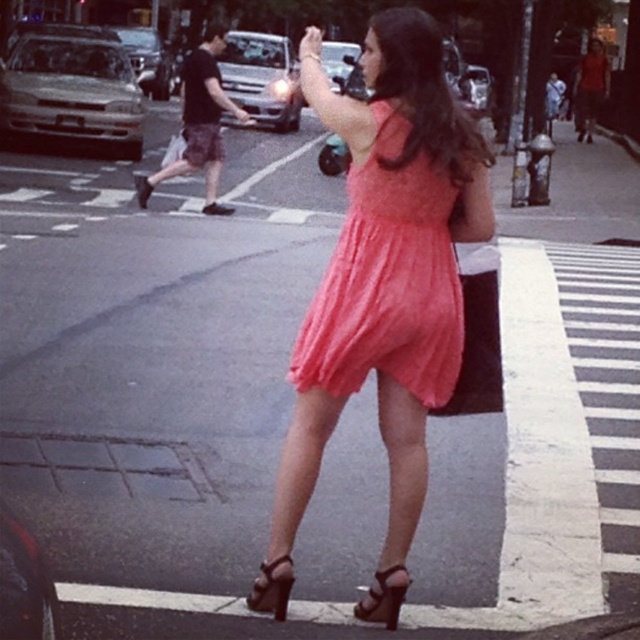
Question: Which object appears closest to the camera in this image?

Choices:
 (A) brown leather sandal at lower center
 (B) coral fabric dress at center
 (C) shiny brown sandal at lower center
 (D) coral chiffon dress at center

Answer: (B)

Question: Is shiny brown sandal at lower center thinner than brown leather sandal at lower center?

Choices:
 (A) yes
 (B) no

Answer: (B)

Question: Estimate the real-world distances between objects in this image. Which object is farther from the coral fabric dress at center?

Choices:
 (A) shiny brown sandal at lower center
 (B) brown leather sandal at lower center
 (C) coral chiffon dress at center

Answer: (B)

Question: Does coral chiffon dress at center appear on the right side of brown leather sandal at lower center?

Choices:
 (A) yes
 (B) no

Answer: (A)

Question: Which point appears closest to the camera in this image?

Choices:
 (A) [337, 106]
 (B) [408, 579]
 (C) [272, 564]
 (D) [396, 200]

Answer: (D)

Question: Considering the relative positions of coral fabric dress at center and coral chiffon dress at center in the image provided, where is coral fabric dress at center located with respect to coral chiffon dress at center?

Choices:
 (A) right
 (B) left

Answer: (B)